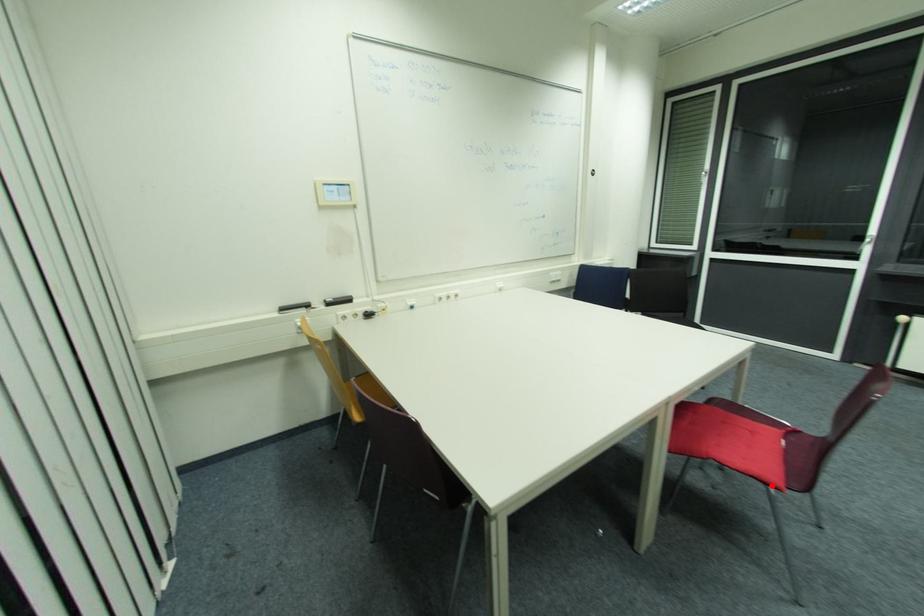
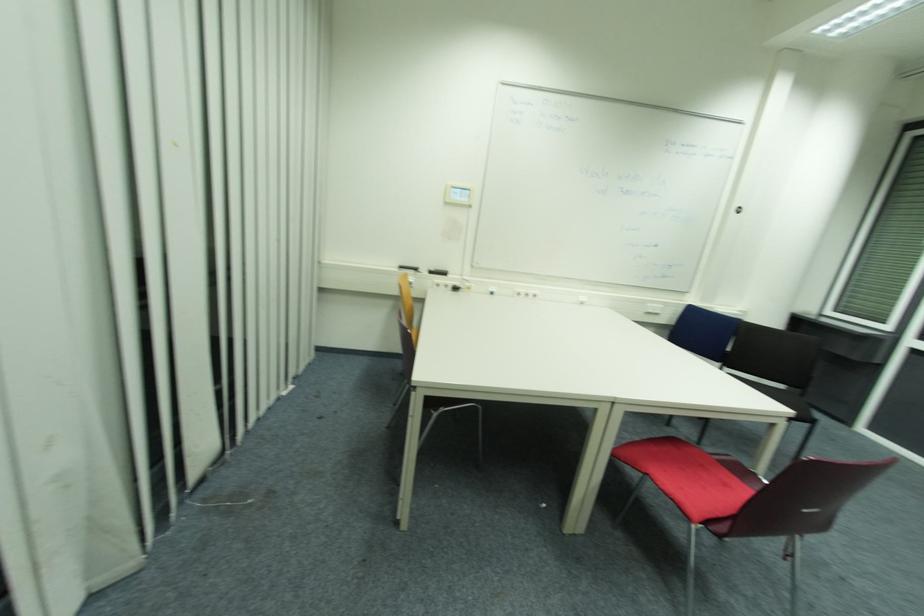
In the second image, find the point that corresponds to the highlighted location in the first image.

(691, 519)